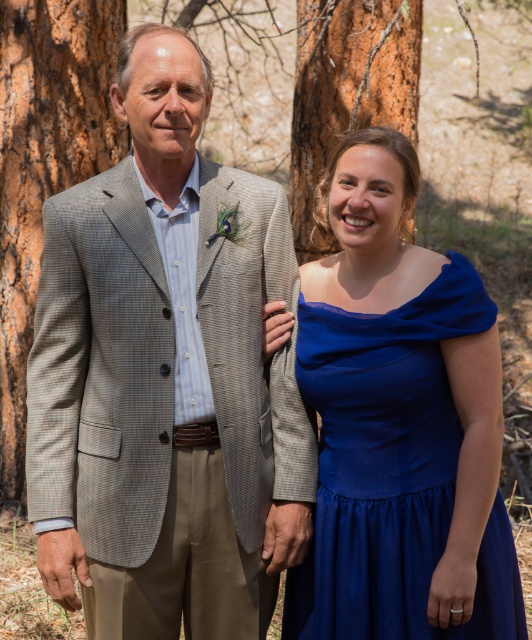
Between royal blue satin dress at right and brown rough bark at upper center, which one is positioned lower?

royal blue satin dress at right is lower down.

Can you confirm if royal blue satin dress at right is bigger than brown rough bark at upper center?

No, royal blue satin dress at right is not bigger than brown rough bark at upper center.

The width and height of the screenshot is (532, 640). Describe the element at coordinates (393, 472) in the screenshot. I see `royal blue satin dress at right` at that location.

Find the location of a particular element. royal blue satin dress at right is located at coordinates (393, 472).

Does point (182, 332) come closer to viewer compared to point (412, 35)?

Yes.

Locate an element on the screen. The width and height of the screenshot is (532, 640). gray checkered suit at left is located at coordinates (164, 378).

Image resolution: width=532 pixels, height=640 pixels. I want to click on gray checkered suit at left, so click(164, 378).

Does gray checkered suit at left have a larger size compared to brown textured bark at left?

Incorrect, gray checkered suit at left is not larger than brown textured bark at left.

Does point (159, 392) lie behind point (22, 444)?

No, it is in front of (22, 444).

This screenshot has width=532, height=640. In order to click on gray checkered suit at left in this screenshot , I will do `click(164, 378)`.

Find the location of `gray checkered suit at left`. gray checkered suit at left is located at coordinates (164, 378).